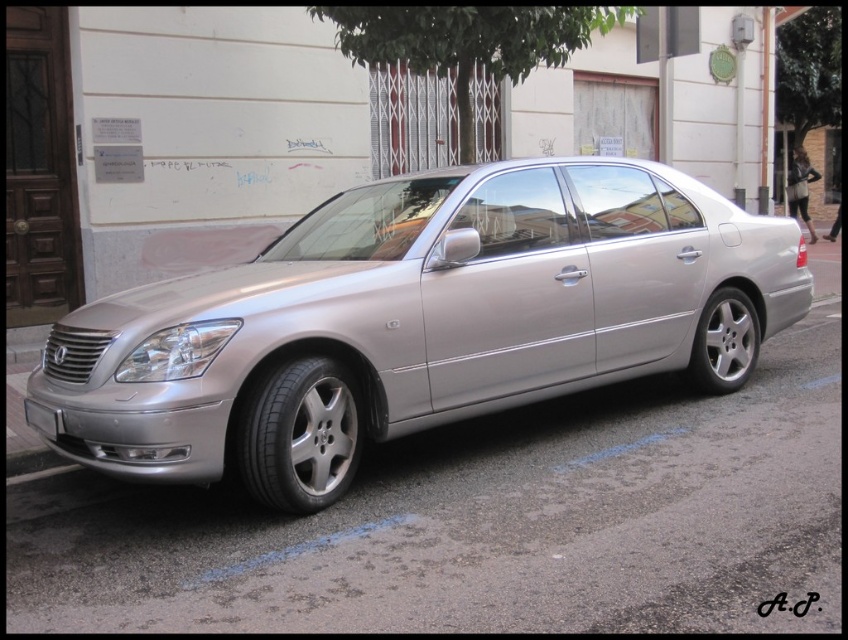
You are a delivery driver who needs to park your vehicle in a parking spot that is the same width as the metallic gray curb at lower left. You are currently driving a silver metallic car at center. Based on the image, do you think your car will fit in the parking spot?

The silver metallic car at center might be wider than metallic gray curb at lower left, so there is a possibility that the car may not fit in the parking spot if the curb indicates the parking space width.

You are a delivery driver who needs to park your car on the curb. You see the silver metallic car at center and the metallic gray curb at lower left. Which direction should you move your car to park on the curb?

The silver metallic car at center is to the right of the metallic gray curb at lower left, so you should move your car to the left to park on the metallic gray curb at lower left.